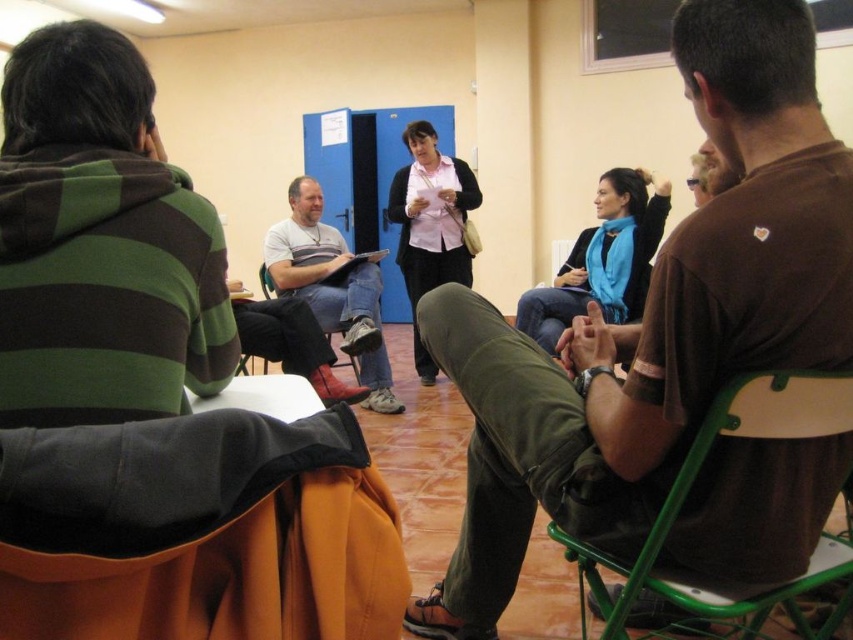
In the described scene, there are two people sitting on chairs in the foreground and another person sitting on a chair in the middle ground. The person in the brown cotton shirt at center is represented by the point at coordinates (654, 323). Can you determine the position of the brown cotton shirt at center relative to the other two people?

The brown cotton shirt at center is represented by the point at coordinates (654, 323), which places it centrally in the middle ground between the foreground individuals.

You are organizing a group photo and need to arrange two people wearing the brown cotton shirt at center and the matte gray shirt at center side by side. Based on their clothing widths, which shirt should be placed on the left to ensure the arrangement looks balanced?

The brown cotton shirt at center has a lesser width compared to the matte gray shirt at center. To balance the arrangement, place the narrower brown cotton shirt at center on the left and the wider matte gray shirt at center on the right.